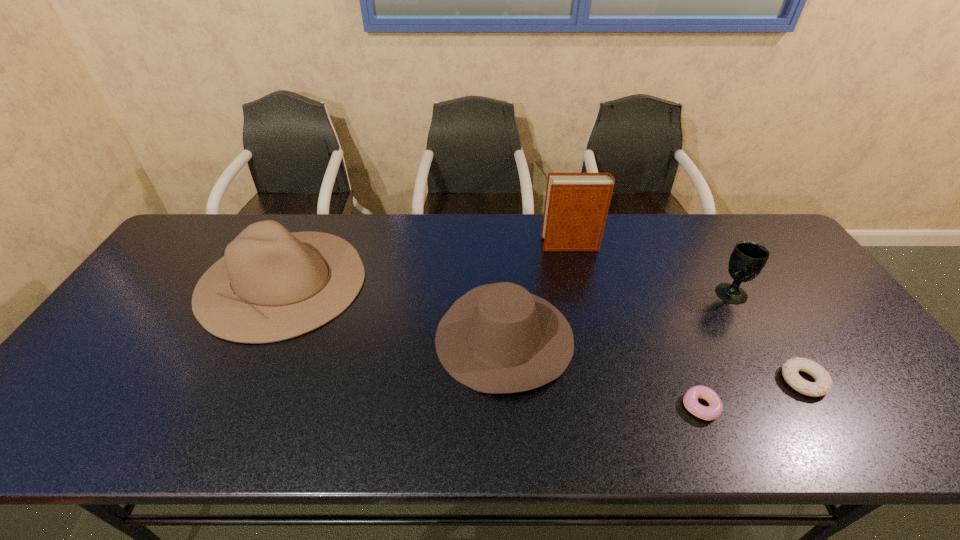
This screenshot has width=960, height=540. What are the coordinates of `free space that satisfies the following two spatial constraints: 1. on the open cover of the hardback book; 2. on the right side of the third object from right to left` in the screenshot? It's located at (610, 407).

I want to click on vacant space that satisfies the following two spatial constraints: 1. on the open cover of the hardback book; 2. on the right side of the left doughnut, so click(610, 407).